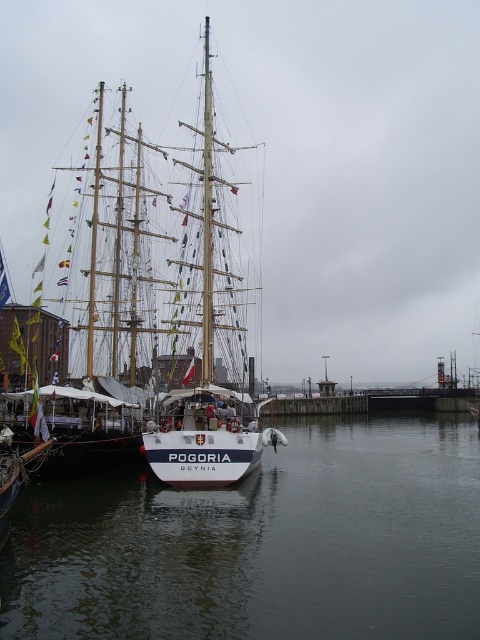
You are standing on the deck of the ship POGORIA and looking out towards the harbor. There is a point marked at coordinates [263,541]. What can you see at that point?

At the coordinates [263,541], you can see clear water at center.